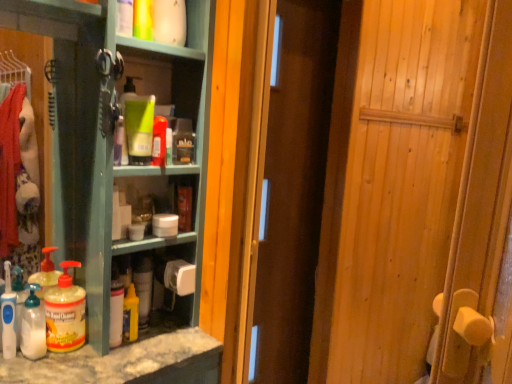
Question: Which direction should I rotate to look at green matte bottle at center, which ranks as the 1th cleaning product in top-to-bottom order?

Choices:
 (A) left
 (B) right

Answer: (A)

Question: Is translucent plastic pump bottle at lower left, the second cleaning product from the left, oriented towards white matte toilet paper at center?

Choices:
 (A) no
 (B) yes

Answer: (A)

Question: Does translucent plastic pump bottle at lower left, which ranks as the third cleaning product in top-to-bottom order, have a smaller size compared to white matte toilet paper at center?

Choices:
 (A) no
 (B) yes

Answer: (A)

Question: From a real-world perspective, is translucent plastic pump bottle at lower left, which ranks as the third cleaning product in top-to-bottom order, located higher than white matte toilet paper at center?

Choices:
 (A) no
 (B) yes

Answer: (A)

Question: Does translucent plastic pump bottle at lower left, acting as the third cleaning product starting from the right, have a lesser height compared to white matte toilet paper at center?

Choices:
 (A) no
 (B) yes

Answer: (A)

Question: Does translucent plastic pump bottle at lower left, which ranks as the third cleaning product in top-to-bottom order, appear on the left side of white matte toilet paper at center?

Choices:
 (A) no
 (B) yes

Answer: (B)

Question: Does translucent plastic pump bottle at lower left, which ranks as the 2th cleaning product in bottom-to-top order, have a greater width compared to white matte toilet paper at center?

Choices:
 (A) yes
 (B) no

Answer: (A)

Question: Would you say white matte toilet paper at center is part of translucent plastic soap dispenser at lower left, the first cleaning product viewed from the left,'s contents?

Choices:
 (A) no
 (B) yes

Answer: (A)

Question: Can you confirm if translucent plastic soap dispenser at lower left, the third cleaning product in the bottom-to-top sequence, is positioned to the left of white matte toilet paper at center?

Choices:
 (A) no
 (B) yes

Answer: (B)

Question: From the image's perspective, is translucent plastic soap dispenser at lower left, which appears as the 4th cleaning product when viewed from the right, over white matte toilet paper at center?

Choices:
 (A) yes
 (B) no

Answer: (B)

Question: Does translucent plastic soap dispenser at lower left, the 2th cleaning product positioned from the top, touch white matte toilet paper at center?

Choices:
 (A) yes
 (B) no

Answer: (B)

Question: Is there a large distance between translucent plastic soap dispenser at lower left, which appears as the 4th cleaning product when viewed from the right, and white matte toilet paper at center?

Choices:
 (A) yes
 (B) no

Answer: (B)

Question: Can you confirm if translucent plastic soap dispenser at lower left, which appears as the 4th cleaning product when viewed from the right, is thinner than white matte toilet paper at center?

Choices:
 (A) yes
 (B) no

Answer: (A)

Question: Does green matte bottle at center, which appears as the 4th cleaning product when viewed from the left, have a smaller size compared to translucent plastic bottle at lower left, positioned as the first bottle in left-to-right order?

Choices:
 (A) yes
 (B) no

Answer: (A)